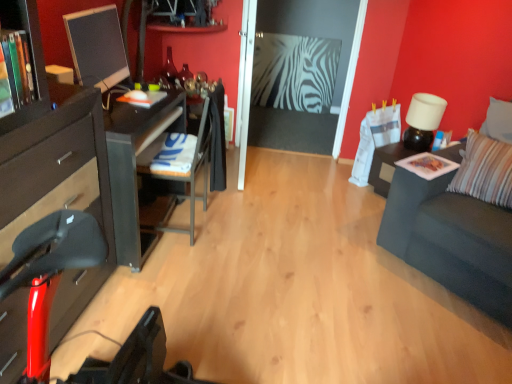
Question: From a real-world perspective, is dark gray fabric couch at right physically located above or below white matte lamp at upper right?

Choices:
 (A) above
 (B) below

Answer: (B)

Question: Is dark gray fabric couch at right taller or shorter than white matte lamp at upper right?

Choices:
 (A) short
 (B) tall

Answer: (B)

Question: Estimate the real-world distances between objects in this image. Which object is closer to the metallic gray chair at center-left?

Choices:
 (A) black glossy nightstand at right
 (B) white matte lamp at upper right
 (C) dark gray fabric couch at right
 (D) metallic silver shelf at upper center
 (E) matte black monitor at left

Answer: (E)

Question: Considering the real-world distances, which object is farthest from the black glossy nightstand at right?

Choices:
 (A) dark gray fabric couch at right
 (B) metallic gray chair at center-left
 (C) matte black monitor at left
 (D) metallic silver shelf at upper center
 (E) white matte lamp at upper right

Answer: (C)